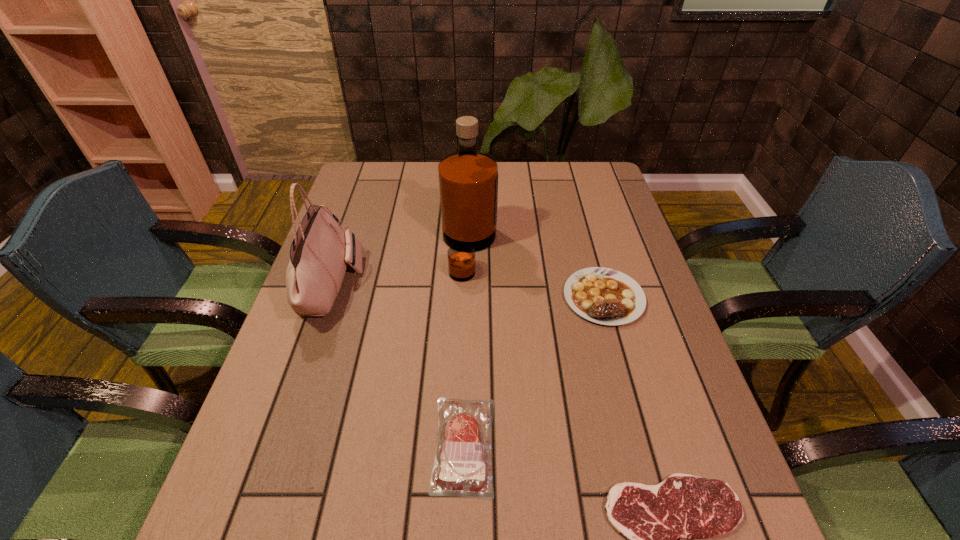
At what (x,y) coordinates should I click in order to perform the action: click on liquor. Please return your answer as a coordinate pair (x, y). This screenshot has height=540, width=960. Looking at the image, I should click on (468, 180).

The width and height of the screenshot is (960, 540). What are the coordinates of `the fourth shortest object` in the screenshot? It's located at (321, 249).

This screenshot has width=960, height=540. I want to click on handbag, so click(x=321, y=249).

At what (x,y) coordinates should I click in order to perform the action: click on the farthest steak. Please return your answer as a coordinate pair (x, y). Image resolution: width=960 pixels, height=540 pixels. Looking at the image, I should click on (605, 296).

At what (x,y) coordinates should I click in order to perform the action: click on the third shortest object. Please return your answer as a coordinate pair (x, y). This screenshot has height=540, width=960. Looking at the image, I should click on (605, 296).

Where is `the second shortest steak`? The image size is (960, 540). the second shortest steak is located at coordinates (460, 469).

Identify the location of the fourth tallest object. This screenshot has height=540, width=960. pos(460,469).

This screenshot has width=960, height=540. Identify the location of vacant space located on the front label of the liquor. point(556,248).

At what (x,y) coordinates should I click in order to perform the action: click on vacant space located 0.370m on the side of the handbag with the attached pouch. Please return your answer as a coordinate pair (x, y). The height and width of the screenshot is (540, 960). Looking at the image, I should click on (499, 285).

At what (x,y) coordinates should I click in order to perform the action: click on free space located on the back of the farthest steak. Please return your answer as a coordinate pair (x, y). This screenshot has height=540, width=960. Looking at the image, I should click on (578, 205).